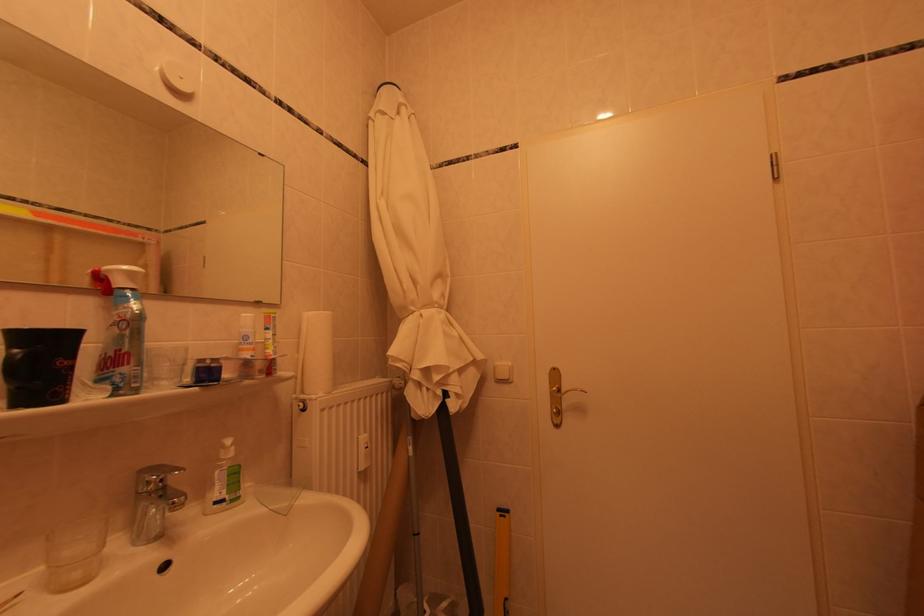
Identify the location of yellow level tool. The height and width of the screenshot is (616, 924). (502, 562).